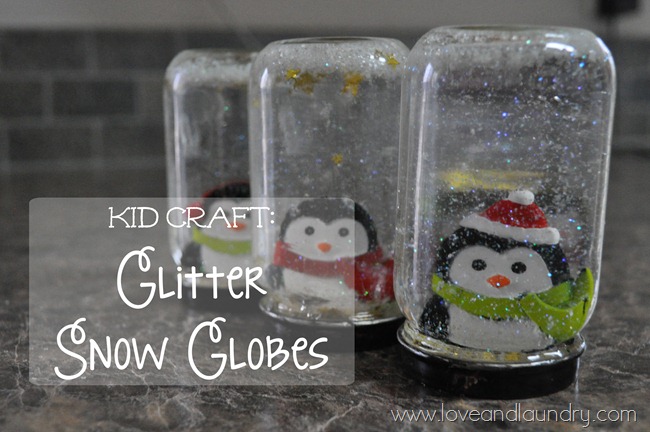
Locate an element on the screen. This screenshot has height=432, width=650. wall is located at coordinates (114, 117).